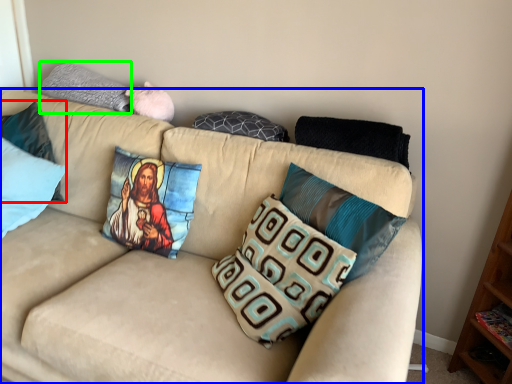
Question: Estimate the real-world distances between objects in this image. Which object is farther from pillow (highlighted by a red box), studio couch (highlighted by a blue box) or pillow (highlighted by a green box)?

Choices:
 (A) studio couch
 (B) pillow

Answer: (A)